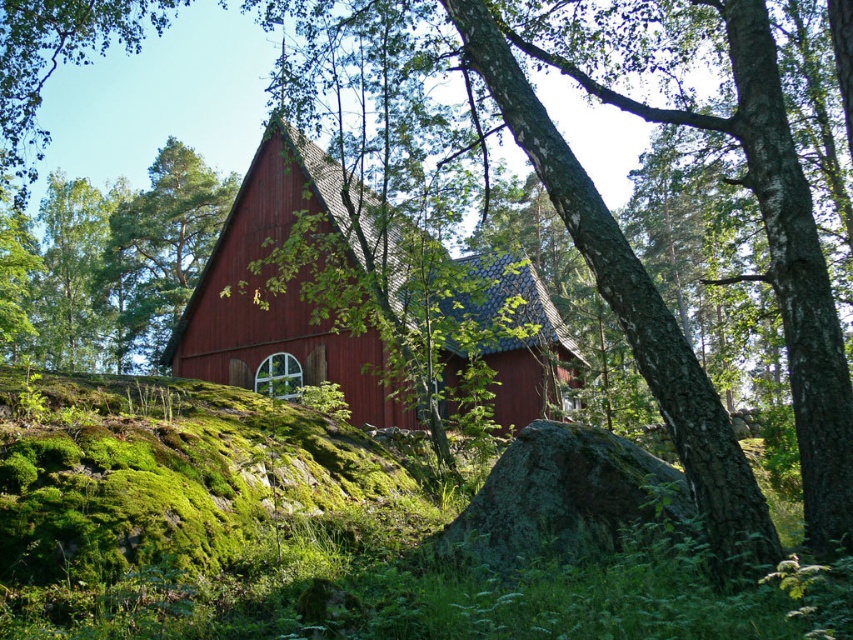
Question: Observing the image, what is the correct spatial positioning of matte wooden barn at center in reference to smooth bark tree at center?

Choices:
 (A) right
 (B) left

Answer: (A)

Question: Which object appears closest to the camera in this image?

Choices:
 (A) smooth bark tree at center
 (B) matte wooden barn at center

Answer: (B)

Question: Which point is closer to the camera?

Choices:
 (A) (213, 182)
 (B) (223, 372)

Answer: (B)

Question: Does matte wooden barn at center have a smaller size compared to smooth bark tree at center?

Choices:
 (A) no
 (B) yes

Answer: (B)

Question: Does matte wooden barn at center come behind smooth bark tree at center?

Choices:
 (A) yes
 (B) no

Answer: (B)